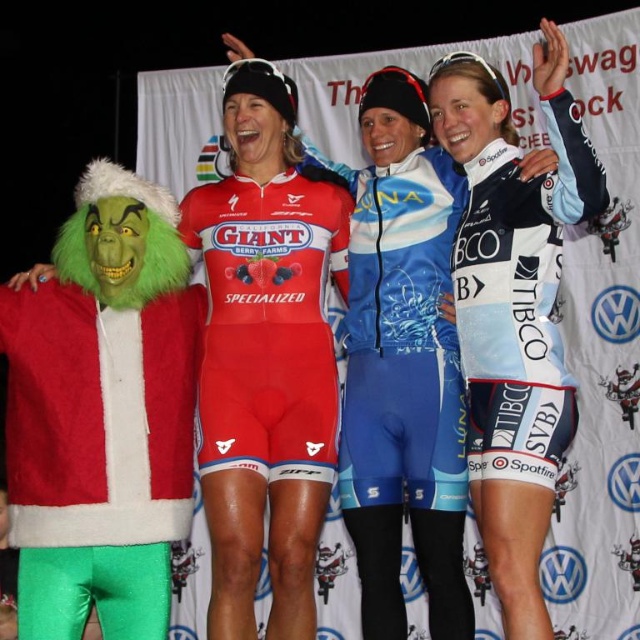
Question: From the image, what is the correct spatial relationship of blue/white jersey at center in relation to white/blue jersey at center?

Choices:
 (A) below
 (B) above

Answer: (A)

Question: Is matte red cycling suit at center to the right of white/blue jersey at center from the viewer's perspective?

Choices:
 (A) no
 (B) yes

Answer: (A)

Question: Which point is closer to the camera?

Choices:
 (A) fuzzy red santa coat at left
 (B) matte red cycling suit at center
 (C) blue/white jersey at center
 (D) white/blue jersey at center

Answer: (D)

Question: Which point is closer to the camera taking this photo?

Choices:
 (A) (456, 512)
 (B) (204, 458)

Answer: (A)

Question: Does fuzzy red santa coat at left appear on the left side of blue/white jersey at center?

Choices:
 (A) no
 (B) yes

Answer: (B)

Question: Based on their relative distances, which object is nearer to the white/blue jersey at center?

Choices:
 (A) matte red cycling suit at center
 (B) blue matte cycling jersey at center
 (C) blue/white jersey at center
 (D) fuzzy red santa coat at left

Answer: (C)